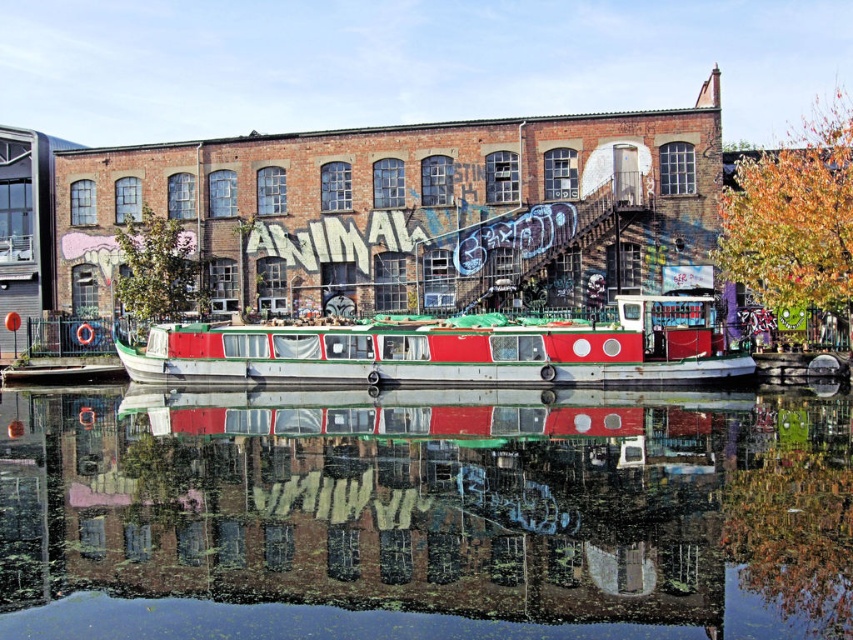
You are standing on the canal boat and looking at the scene. There is a point at coordinate (424, 518). What is located at that point?

The point at coordinate (424, 518) indicates green reflective water at center.